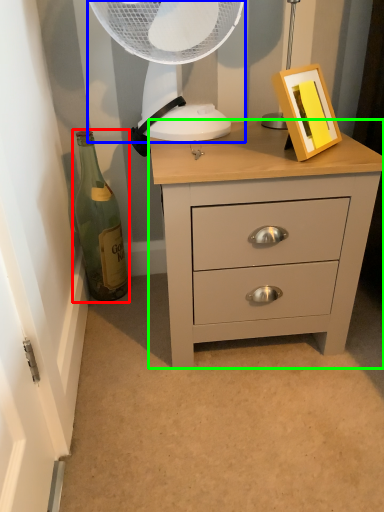
Question: Based on their relative distances, which object is farther from bottle (highlighted by a red box)? Choose from mechanical fan (highlighted by a blue box) and chest of drawers (highlighted by a green box).

Choices:
 (A) mechanical fan
 (B) chest of drawers

Answer: (B)